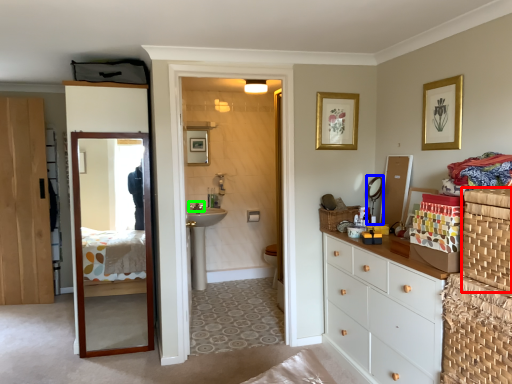
Question: Which object is positioned farthest from basket container (highlighted by a red box)? Select from mirror (highlighted by a blue box) and faucet (highlighted by a green box).

Choices:
 (A) mirror
 (B) faucet

Answer: (B)